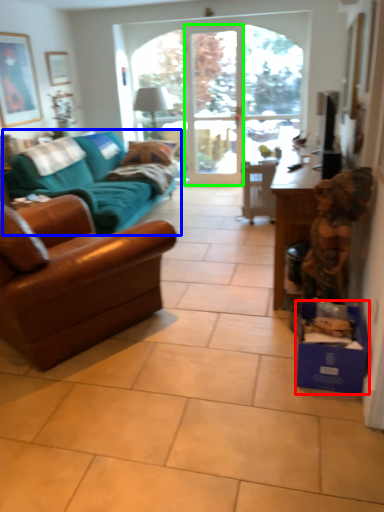
Question: Which object is positioned closest to cardboard box (highlighted by a red box)? Select from studio couch (highlighted by a blue box) and screen door (highlighted by a green box).

Choices:
 (A) studio couch
 (B) screen door

Answer: (A)